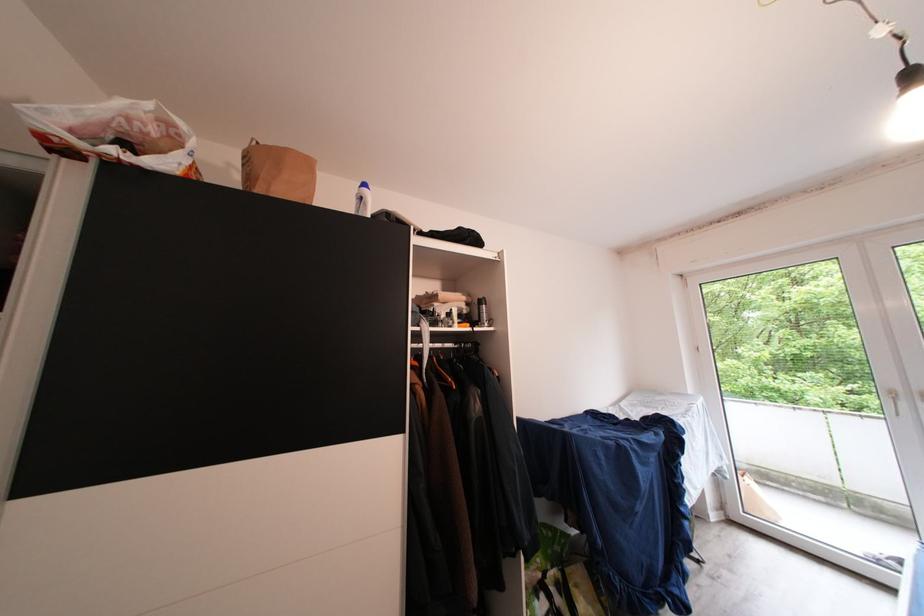
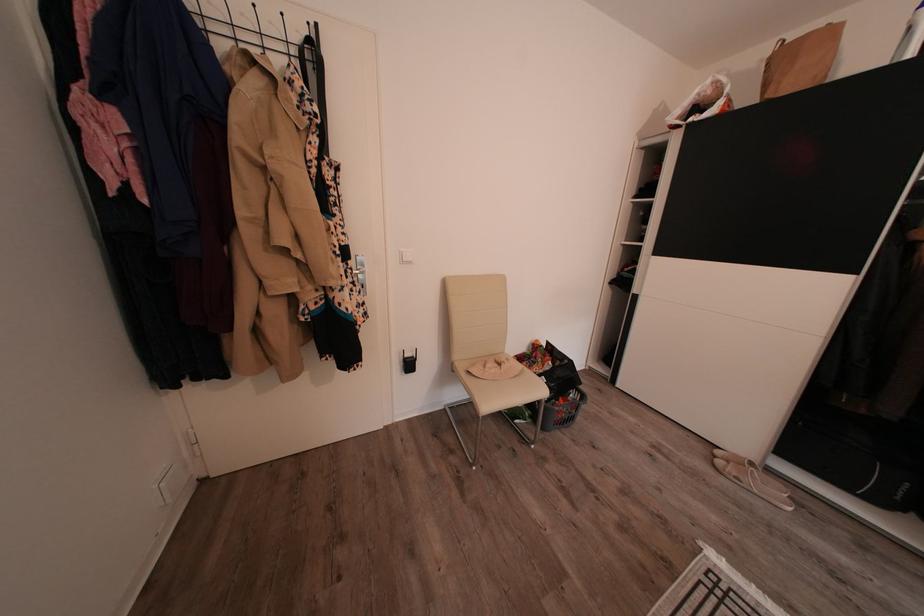
In the second image, find the point that corresponds to [258,183] in the first image.

(773, 91)